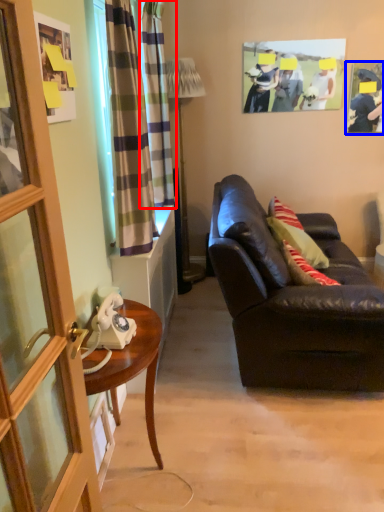
Question: Which object appears farthest to the camera in this image, curtain (highlighted by a red box) or picture frame (highlighted by a blue box)?

Choices:
 (A) curtain
 (B) picture frame

Answer: (B)